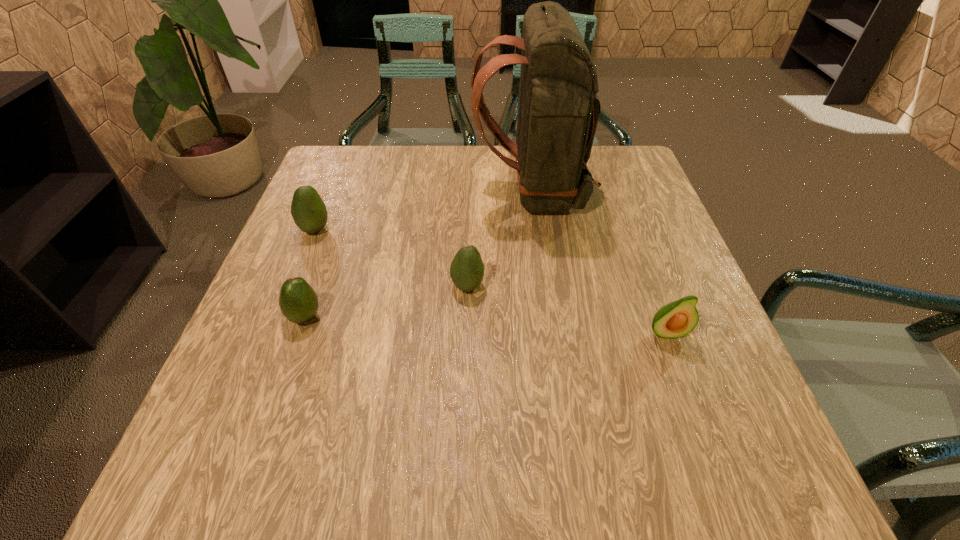
The height and width of the screenshot is (540, 960). I want to click on backpack, so click(558, 109).

Where is `the farthest avocado`? The image size is (960, 540). the farthest avocado is located at coordinates (308, 210).

You are a GUI agent. You are given a task and a screenshot of the screen. Output one action in this format:
    pyautogui.click(x=<x>, y=<y>)
    Task: Click on the rightmost object
    Image resolution: width=960 pixels, height=540 pixels.
    Given the screenshot: What is the action you would take?
    pyautogui.click(x=677, y=319)

Where is `the third nearest avocado`? The image size is (960, 540). the third nearest avocado is located at coordinates (467, 269).

The width and height of the screenshot is (960, 540). In order to click on the third farthest object in this screenshot , I will do `click(467, 269)`.

Image resolution: width=960 pixels, height=540 pixels. In order to click on vacant area situated 0.370m on the back of the backpack in this screenshot , I will do `click(328, 191)`.

Where is `free space located on the back of the backpack`? This screenshot has width=960, height=540. free space located on the back of the backpack is located at coordinates pyautogui.click(x=363, y=191).

Identify the location of vacant area situated on the back of the backpack. The image size is (960, 540). (444, 191).

Identify the location of vacant region located on the right of the farthest avocado. (482, 230).

I want to click on blank space located on the cut side of the rightmost avocado, so click(683, 377).